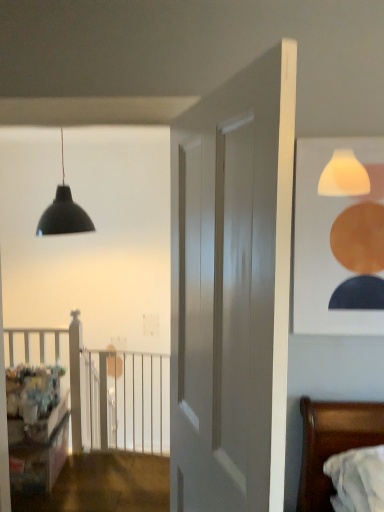
Question: From a real-world perspective, is matte black pendant light at upper left physically located above or below wooden dresser at lower left?

Choices:
 (A) above
 (B) below

Answer: (A)

Question: Do you think matte black pendant light at upper left is within wooden dresser at lower left, or outside of it?

Choices:
 (A) inside
 (B) outside

Answer: (B)

Question: Which is farther from the white smooth door at center?

Choices:
 (A) wooden dresser at lower left
 (B) matte white picture frame at upper right
 (C) matte black pendant light at upper left
 (D) white metal balustrade at center
 (E) wooden bed at lower right

Answer: (C)

Question: Estimate the real-world distances between objects in this image. Which object is closer to the white smooth door at center?

Choices:
 (A) wooden bed at lower right
 (B) white metal balustrade at center
 (C) matte white picture frame at upper right
 (D) matte black pendant light at upper left
 (E) wooden dresser at lower left

Answer: (C)